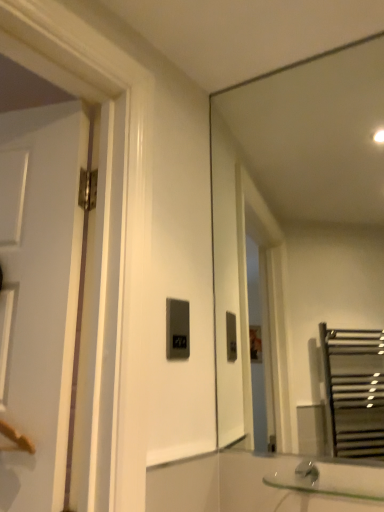
Describe the element at coordinates (296, 227) in the screenshot. The height and width of the screenshot is (512, 384). I see `transparent glass mirror at upper right` at that location.

You are a GUI agent. You are given a task and a screenshot of the screen. Output one action in this format:
    pyautogui.click(x=<x>, y=<y>)
    Task: Click on the clear glass sink at lower right
    Image resolution: width=384 pixels, height=512 pixels.
    Given the screenshot: What is the action you would take?
    pyautogui.click(x=332, y=479)

I want to click on matte black switch at center, so click(x=177, y=329).

At what (x,y) coordinates should I click in order to perform the action: click on transparent glass mirror at upper right. Please return your answer as a coordinate pair (x, y). Looking at the image, I should click on (296, 227).

Could you tell me if clear glass sink at lower right is facing transparent glass mirror at upper right?

No, clear glass sink at lower right is not turned towards transparent glass mirror at upper right.

Is clear glass sink at lower right not close to transparent glass mirror at upper right?

Yes, clear glass sink at lower right and transparent glass mirror at upper right are located far from each other.

Is clear glass sink at lower right smaller than transparent glass mirror at upper right?

Indeed, clear glass sink at lower right has a smaller size compared to transparent glass mirror at upper right.

From the picture: From the image's perspective, would you say matte black switch at center is shown under clear glass sink at lower right?

No, from the image's perspective, matte black switch at center is not beneath clear glass sink at lower right.

Considering the sizes of objects matte black switch at center and clear glass sink at lower right in the image provided, who is smaller, matte black switch at center or clear glass sink at lower right?

With smaller size is matte black switch at center.

Is matte black switch at center inside or outside of clear glass sink at lower right?

matte black switch at center is spatially situated outside clear glass sink at lower right.

From the image's perspective, is transparent glass mirror at upper right located above clear glass sink at lower right?

Indeed, from the image's perspective, transparent glass mirror at upper right is shown above clear glass sink at lower right.

Based on the photo, is transparent glass mirror at upper right positioned with its back to clear glass sink at lower right?

transparent glass mirror at upper right is not turned away from clear glass sink at lower right.

Is the depth of transparent glass mirror at upper right less than that of clear glass sink at lower right?

No, it is behind clear glass sink at lower right.

Is matte black switch at center far away from transparent glass mirror at upper right?

matte black switch at center is positioned a significant distance from transparent glass mirror at upper right.

Between matte black switch at center and transparent glass mirror at upper right, which one has smaller size?

Smaller between the two is matte black switch at center.

Is matte black switch at center positioned beyond the bounds of transparent glass mirror at upper right?

That's correct, matte black switch at center is outside of transparent glass mirror at upper right.

Is the depth of matte black switch at center less than that of transparent glass mirror at upper right?

No, matte black switch at center is further to the viewer.

Which point is more forward, (335, 486) or (176, 355)?

The point (335, 486) is in front.

Does clear glass sink at lower right have a greater width compared to matte black switch at center?

Yes.

Who is shorter, clear glass sink at lower right or matte black switch at center?

clear glass sink at lower right.

Is transparent glass mirror at upper right positioned far away from matte black switch at center?

Absolutely, transparent glass mirror at upper right is distant from matte black switch at center.

Which object is closer to the camera taking this photo, transparent glass mirror at upper right or matte black switch at center?

Positioned in front is transparent glass mirror at upper right.

Does transparent glass mirror at upper right have a greater height compared to matte black switch at center?

Indeed, transparent glass mirror at upper right has a greater height compared to matte black switch at center.

Who is smaller, transparent glass mirror at upper right or matte black switch at center?

matte black switch at center is smaller.

You are a GUI agent. You are given a task and a screenshot of the screen. Output one action in this format:
    pyautogui.click(x=<x>, y=<y>)
    Task: Click on the sink that appears on the left of transparent glass mirror at upper right
    The image size is (384, 512).
    Given the screenshot: What is the action you would take?
    pyautogui.click(x=332, y=479)

Locate an element on the screen. sink below the matte black switch at center (from the image's perspective) is located at coordinates (332, 479).

Which object lies further to the anchor point clear glass sink at lower right, matte black switch at center or transparent glass mirror at upper right?

Among the two, transparent glass mirror at upper right is located further to clear glass sink at lower right.

Which object lies further to the anchor point transparent glass mirror at upper right, clear glass sink at lower right or matte black switch at center?

Among the two, clear glass sink at lower right is located further to transparent glass mirror at upper right.

Considering their positions, is transparent glass mirror at upper right positioned closer to matte black switch at center than clear glass sink at lower right?

Among the two, clear glass sink at lower right is located nearer to matte black switch at center.

Based on their spatial positions, is clear glass sink at lower right or transparent glass mirror at upper right closer to matte black switch at center?

clear glass sink at lower right.

Based on their spatial positions, is matte black switch at center or clear glass sink at lower right further from transparent glass mirror at upper right?

clear glass sink at lower right lies further to transparent glass mirror at upper right than the other object.

Looking at the image, which one is located closer to clear glass sink at lower right, transparent glass mirror at upper right or matte black switch at center?

matte black switch at center.

The image size is (384, 512). In order to click on light switch that lies between transparent glass mirror at upper right and clear glass sink at lower right from top to bottom in this screenshot , I will do `click(177, 329)`.